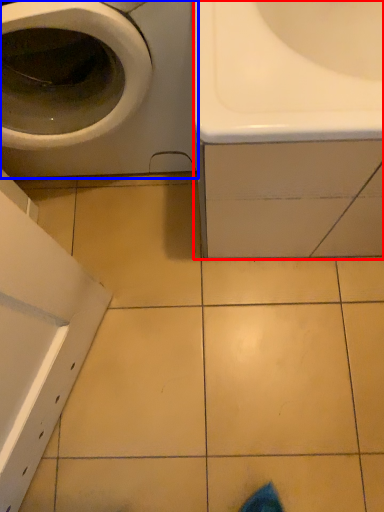
Question: Which of the following is the closest to the observer, sink (highlighted by a red box) or washing machine (highlighted by a blue box)?

Choices:
 (A) sink
 (B) washing machine

Answer: (B)